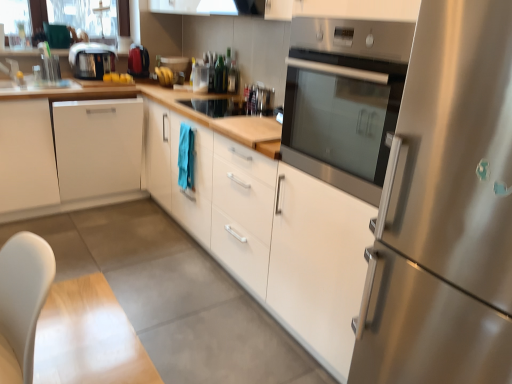
Describe the element at coordinates (10, 68) in the screenshot. This screenshot has height=384, width=512. I see `brushed metal faucet at upper left` at that location.

Measure the distance between white matte cabinet at center, placed as the second cabinetry when sorted from left to right, and camera.

A distance of 1.48 meters exists between white matte cabinet at center, placed as the second cabinetry when sorted from left to right, and camera.

The image size is (512, 384). Identify the location of clear glass jar at center, placed as the second appliance when sorted from left to right. (200, 78).

This screenshot has width=512, height=384. What do you see at coordinates (200, 78) in the screenshot?
I see `clear glass jar at center, placed as the second appliance when sorted from left to right` at bounding box center [200, 78].

You are a GUI agent. You are given a task and a screenshot of the screen. Output one action in this format:
    pyautogui.click(x=<x>, y=<y>)
    Task: Click on the white matte cabinet at left, acting as the first cabinetry starting from the left
    This screenshot has width=512, height=384.
    Given the screenshot: What is the action you would take?
    pyautogui.click(x=68, y=155)

Image resolution: width=512 pixels, height=384 pixels. Describe the element at coordinates (344, 99) in the screenshot. I see `stainless steel oven at center` at that location.

Find the location of `matte red toaster at upper left, the 1th appliance viewed from the left`. matte red toaster at upper left, the 1th appliance viewed from the left is located at coordinates (138, 61).

Does point (88, 46) appear closer or farther from the camera than point (327, 239)?

Clearly, point (88, 46) is more distant from the camera than point (327, 239).

Considering the positions of objects satin black toaster at upper left and white matte cabinet at center, arranged as the first cabinetry when viewed from the right, in the image provided, who is more to the right, satin black toaster at upper left or white matte cabinet at center, arranged as the first cabinetry when viewed from the right,?

white matte cabinet at center, arranged as the first cabinetry when viewed from the right, is more to the right.

Is satin black toaster at upper left facing away from white matte cabinet at center, arranged as the first cabinetry when viewed from the right?

No, satin black toaster at upper left is not facing away from white matte cabinet at center, arranged as the first cabinetry when viewed from the right.

Is satin black toaster at upper left far from white matte cabinet at center, arranged as the first cabinetry when viewed from the right?

Indeed, satin black toaster at upper left is not near white matte cabinet at center, arranged as the first cabinetry when viewed from the right.

In the scene shown: Is brushed metal faucet at upper left far from white matte cabinet at center, placed as the second cabinetry when sorted from left to right?

brushed metal faucet at upper left is far away from white matte cabinet at center, placed as the second cabinetry when sorted from left to right.

Can you confirm if brushed metal faucet at upper left is wider than white matte cabinet at center, arranged as the first cabinetry when viewed from the right?

In fact, brushed metal faucet at upper left might be narrower than white matte cabinet at center, arranged as the first cabinetry when viewed from the right.

Can you confirm if brushed metal faucet at upper left is bigger than white matte cabinet at center, arranged as the first cabinetry when viewed from the right?

Actually, brushed metal faucet at upper left might be smaller than white matte cabinet at center, arranged as the first cabinetry when viewed from the right.

From a real-world perspective, is brushed metal faucet at upper left positioned under white matte cabinet at center, arranged as the first cabinetry when viewed from the right, based on gravity?

No, from a real-world perspective, brushed metal faucet at upper left is not under white matte cabinet at center, arranged as the first cabinetry when viewed from the right.

Considering the relative sizes of white matte cabinet at left, acting as the first cabinetry starting from the left, and stainless steel oven at center in the image provided, is white matte cabinet at left, acting as the first cabinetry starting from the left, wider than stainless steel oven at center?

Correct, the width of white matte cabinet at left, acting as the first cabinetry starting from the left, exceeds that of stainless steel oven at center.

Consider the image. Considering the relative sizes of white matte cabinet at left, the 2th cabinetry when ordered from right to left, and stainless steel oven at center in the image provided, is white matte cabinet at left, the 2th cabinetry when ordered from right to left, taller than stainless steel oven at center?

Indeed, white matte cabinet at left, the 2th cabinetry when ordered from right to left, has a greater height compared to stainless steel oven at center.

Are white matte cabinet at left, acting as the first cabinetry starting from the left, and stainless steel oven at center far apart?

Absolutely, white matte cabinet at left, acting as the first cabinetry starting from the left, is distant from stainless steel oven at center.

Where is `the 2nd appliance above the white matte cabinet at center, placed as the second cabinetry when sorted from left to right (from the image's perspective)`? This screenshot has height=384, width=512. the 2nd appliance above the white matte cabinet at center, placed as the second cabinetry when sorted from left to right (from the image's perspective) is located at coordinates (138, 61).

Based on the photo, is white matte cabinet at center, placed as the second cabinetry when sorted from left to right, oriented towards matte red toaster at upper left, the 1th appliance viewed from the left?

No, white matte cabinet at center, placed as the second cabinetry when sorted from left to right, does not turn towards matte red toaster at upper left, the 1th appliance viewed from the left.

Is white matte cabinet at center, arranged as the first cabinetry when viewed from the right, located outside matte red toaster at upper left, which is the second appliance from right to left?

Yes, white matte cabinet at center, arranged as the first cabinetry when viewed from the right, is not within matte red toaster at upper left, which is the second appliance from right to left.

Considering the sizes of white matte cabinet at center, placed as the second cabinetry when sorted from left to right, and matte red toaster at upper left, which is the second appliance from right to left, in the image, is white matte cabinet at center, placed as the second cabinetry when sorted from left to right, wider or thinner than matte red toaster at upper left, which is the second appliance from right to left,?

Considering their sizes, white matte cabinet at center, placed as the second cabinetry when sorted from left to right, looks broader than matte red toaster at upper left, which is the second appliance from right to left.

The image size is (512, 384). In order to click on the 2nd appliance to the right of the brushed metal faucet at upper left, counting from the anchor's position in this screenshot , I will do `click(200, 78)`.

In the scene shown: Which object is further away from the camera, brushed metal faucet at upper left or clear glass jar at center, placed as the 1th appliance when sorted from right to left?

clear glass jar at center, placed as the 1th appliance when sorted from right to left, is further away from the camera.

Is brushed metal faucet at upper left at the left side of clear glass jar at center, placed as the second appliance when sorted from left to right?

Indeed, brushed metal faucet at upper left is positioned on the left side of clear glass jar at center, placed as the second appliance when sorted from left to right.

Between brushed metal faucet at upper left and clear glass jar at center, placed as the second appliance when sorted from left to right, which one has smaller width?

Thinner between the two is clear glass jar at center, placed as the second appliance when sorted from left to right.

Identify the location of the 2nd cabinetry below when counting from the clear glass jar at center, placed as the second appliance when sorted from left to right (from the image's perspective). This screenshot has width=512, height=384. (269, 231).

From the image's perspective, relative to clear glass jar at center, placed as the 1th appliance when sorted from right to left, is white matte cabinet at center, arranged as the first cabinetry when viewed from the right, above or below?

white matte cabinet at center, arranged as the first cabinetry when viewed from the right, is situated lower than clear glass jar at center, placed as the 1th appliance when sorted from right to left, in the image.

Is white matte cabinet at center, placed as the second cabinetry when sorted from left to right, not close to clear glass jar at center, placed as the second appliance when sorted from left to right?

Indeed, white matte cabinet at center, placed as the second cabinetry when sorted from left to right, is not near clear glass jar at center, placed as the second appliance when sorted from left to right.

Is white matte cabinet at center, arranged as the first cabinetry when viewed from the right, surrounding clear glass jar at center, placed as the 1th appliance when sorted from right to left?

That's incorrect, clear glass jar at center, placed as the 1th appliance when sorted from right to left, is not inside white matte cabinet at center, arranged as the first cabinetry when viewed from the right.

In order to click on home appliance that appears on the left of stainless steel refrigerator at right in this screenshot , I will do `click(344, 99)`.

From the image's perspective, which one is positioned lower, stainless steel refrigerator at right or stainless steel oven at center?

From the image's view, stainless steel refrigerator at right is below.

Between stainless steel refrigerator at right and stainless steel oven at center, which one has larger size?

stainless steel refrigerator at right is bigger.

At what (x,y) coordinates should I click in order to perform the action: click on the 2nd cabinetry in front of the satin black toaster at upper left, counting from the anchor's position. Please return your answer as a coordinate pair (x, y). Image resolution: width=512 pixels, height=384 pixels. Looking at the image, I should click on (269, 231).

Identify the location of faucet above the white matte cabinet at center, placed as the second cabinetry when sorted from left to right (from a real-world perspective). The height and width of the screenshot is (384, 512). [10, 68].

Based on their spatial positions, is brushed metal faucet at upper left or stainless steel oven at center further from clear glass jar at center, placed as the 1th appliance when sorted from right to left?

Based on the image, stainless steel oven at center appears to be further to clear glass jar at center, placed as the 1th appliance when sorted from right to left.

Which object lies further to the anchor point white matte cabinet at left, the 2th cabinetry when ordered from right to left, stainless steel oven at center or white matte cabinet at center, placed as the second cabinetry when sorted from left to right?

The object further to white matte cabinet at left, the 2th cabinetry when ordered from right to left, is stainless steel oven at center.

From the image, which object appears to be farther from matte red toaster at upper left, which is the second appliance from right to left, satin black toaster at upper left or white matte cabinet at center, placed as the second cabinetry when sorted from left to right?

The object further to matte red toaster at upper left, which is the second appliance from right to left, is white matte cabinet at center, placed as the second cabinetry when sorted from left to right.

From the image, which object appears to be nearer to white matte cabinet at center, placed as the second cabinetry when sorted from left to right, satin black toaster at upper left or stainless steel refrigerator at right?

stainless steel refrigerator at right lies closer to white matte cabinet at center, placed as the second cabinetry when sorted from left to right, than the other object.

When comparing their distances from satin black toaster at upper left, does stainless steel oven at center or matte red toaster at upper left, which is the second appliance from right to left, seem further?

The object further to satin black toaster at upper left is stainless steel oven at center.

Considering their positions, is stainless steel refrigerator at right positioned further to white matte cabinet at center, arranged as the first cabinetry when viewed from the right, than clear glass jar at center, placed as the second appliance when sorted from left to right?

clear glass jar at center, placed as the second appliance when sorted from left to right.

Estimate the real-world distances between objects in this image. Which object is closer to matte red toaster at upper left, which is the second appliance from right to left, stainless steel refrigerator at right or white matte cabinet at left, the 2th cabinetry when ordered from right to left?

Based on the image, white matte cabinet at left, the 2th cabinetry when ordered from right to left, appears to be nearer to matte red toaster at upper left, which is the second appliance from right to left.

Which object lies further to the anchor point white matte cabinet at center, arranged as the first cabinetry when viewed from the right, stainless steel oven at center or white matte cabinet at left, acting as the first cabinetry starting from the left?

white matte cabinet at left, acting as the first cabinetry starting from the left, lies further to white matte cabinet at center, arranged as the first cabinetry when viewed from the right, than the other object.

Locate an element on the screen. Image resolution: width=512 pixels, height=384 pixels. appliance situated between white matte cabinet at left, the 2th cabinetry when ordered from right to left, and clear glass jar at center, placed as the 1th appliance when sorted from right to left, from left to right is located at coordinates (138, 61).

Find the location of `kitchen appliance located between brushed metal faucet at upper left and stainless steel oven at center in the left-right direction`. kitchen appliance located between brushed metal faucet at upper left and stainless steel oven at center in the left-right direction is located at coordinates (91, 60).

This screenshot has width=512, height=384. In order to click on home appliance between stainless steel refrigerator at right and white matte cabinet at center, placed as the second cabinetry when sorted from left to right, along the z-axis in this screenshot , I will do `click(344, 99)`.

Where is `appliance between brushed metal faucet at upper left and clear glass jar at center, placed as the second appliance when sorted from left to right, from left to right`? The width and height of the screenshot is (512, 384). appliance between brushed metal faucet at upper left and clear glass jar at center, placed as the second appliance when sorted from left to right, from left to right is located at coordinates (138, 61).